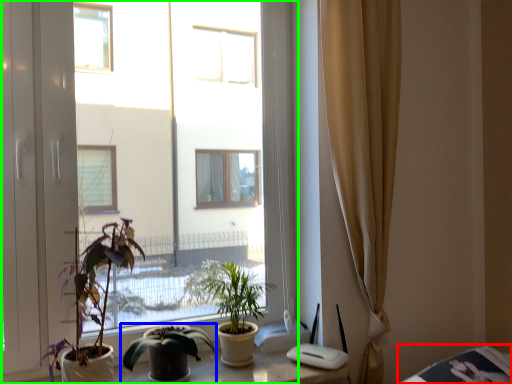
Question: Considering the real-world distances, which object is farthest from table (highlighted by a red box)? houseplant (highlighted by a blue box) or window (highlighted by a green box)?

Choices:
 (A) houseplant
 (B) window

Answer: (B)